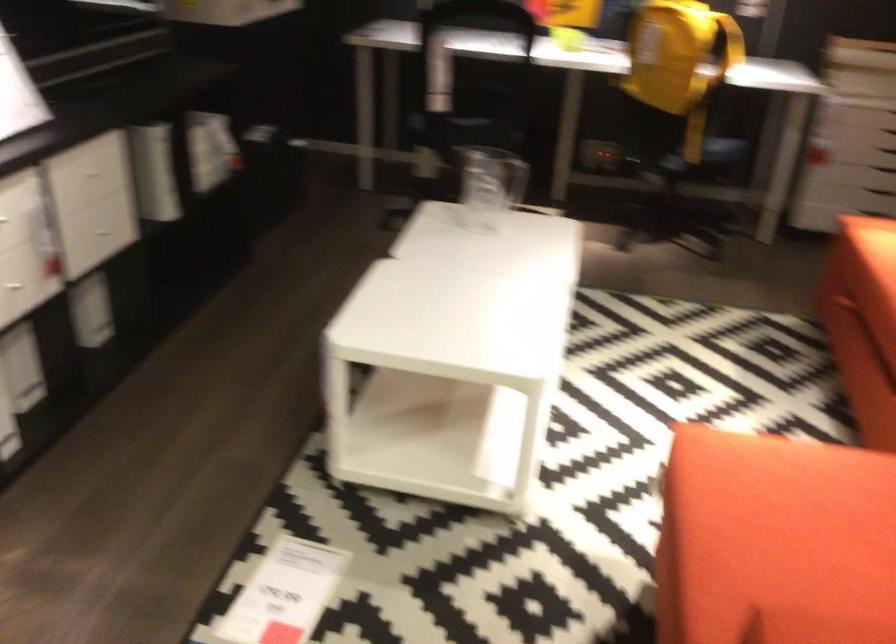
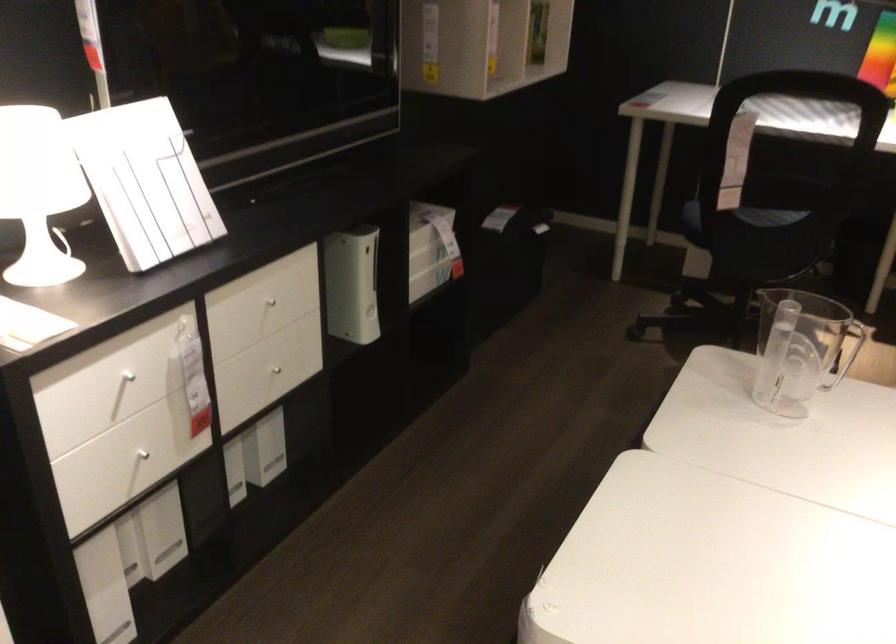
Question: In a continuous first-person perspective shot, in which direction is the camera moving?

Choices:
 (A) Left
 (B) Right
 (C) Forward
 (D) Backward

Answer: (C)